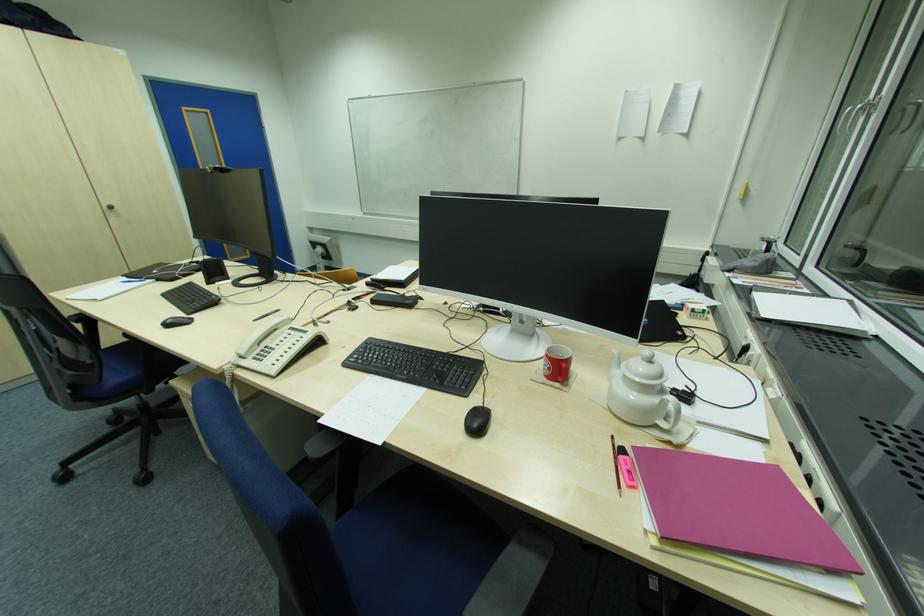
Where is `pink folder`? pink folder is located at coordinates (736, 509).